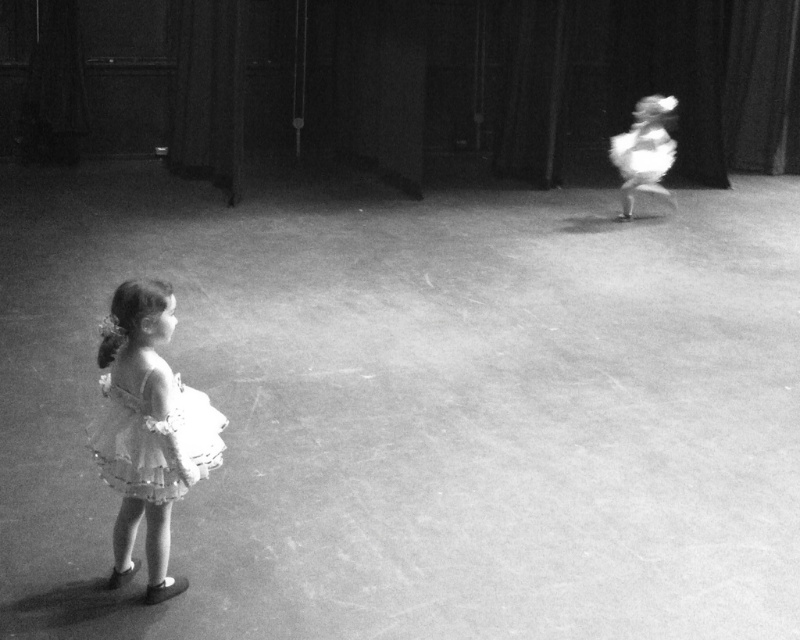
Which is below, white lace dress at lower left or white fluffy tutu at upper right?

white lace dress at lower left is lower down.

Which of these two, white lace dress at lower left or white fluffy tutu at upper right, stands taller?

white fluffy tutu at upper right

Is point (152, 433) less distant than point (672, 109)?

Yes.

In order to click on white lace dress at lower left in this screenshot , I will do `click(156, 440)`.

Is white lace dress at lower left bigger than white fluffy dress at upper right?

No.

Is white lace dress at lower left above white fluffy dress at upper right?

Actually, white lace dress at lower left is below white fluffy dress at upper right.

Is point (186, 432) closer to camera compared to point (645, 141)?

Yes, it is in front of point (645, 141).

The width and height of the screenshot is (800, 640). What are the coordinates of `white lace dress at lower left` in the screenshot? It's located at (156, 440).

Is white fluffy tutu at lower left to the right of white fluffy dress at upper right from the viewer's perspective?

In fact, white fluffy tutu at lower left is to the left of white fluffy dress at upper right.

Can you confirm if white fluffy tutu at lower left is wider than white fluffy dress at upper right?

No, white fluffy tutu at lower left is not wider than white fluffy dress at upper right.

This screenshot has width=800, height=640. What do you see at coordinates (148, 429) in the screenshot?
I see `white fluffy tutu at lower left` at bounding box center [148, 429].

The image size is (800, 640). What are the coordinates of `white fluffy tutu at lower left` in the screenshot? It's located at (148, 429).